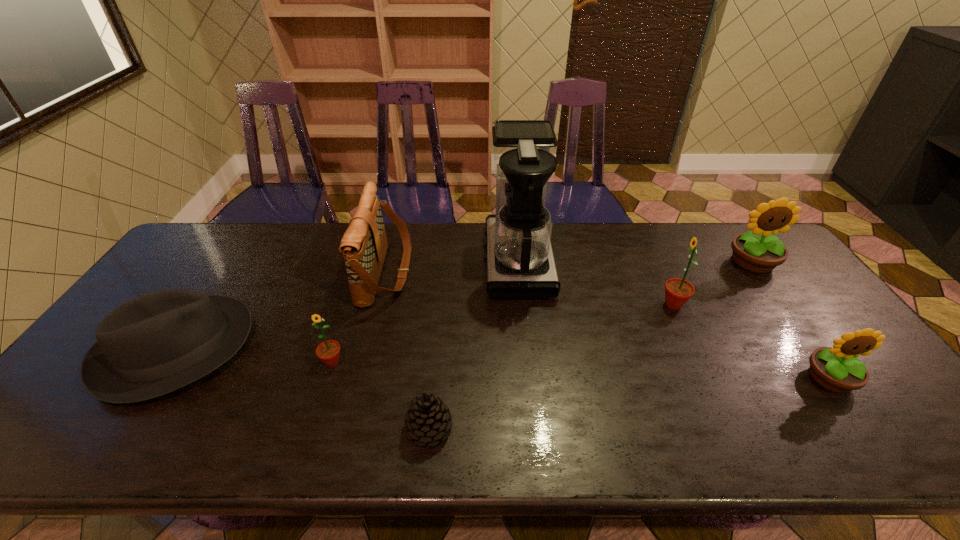
Image resolution: width=960 pixels, height=540 pixels. Identify the location of the fifth object from left to right. (520, 264).

In order to click on coffee maker in this screenshot , I will do `click(520, 264)`.

You are a GUI agent. You are given a task and a screenshot of the screen. Output one action in this format:
    pyautogui.click(x=<x>, y=<y>)
    Task: Click on the farthest sunflower
    
    Given the screenshot: What is the action you would take?
    pyautogui.click(x=759, y=251)

In order to click on the bigger yellow sunflower in this screenshot , I will do `click(759, 251)`.

Where is `the third sunflower from right to left`? the third sunflower from right to left is located at coordinates (677, 291).

Where is `the second farthest sunflower`? The image size is (960, 540). the second farthest sunflower is located at coordinates (677, 291).

Where is `shoulder bag`? Image resolution: width=960 pixels, height=540 pixels. shoulder bag is located at coordinates (364, 245).

This screenshot has height=540, width=960. I want to click on the nearer yellow sunflower, so tap(838, 369).

This screenshot has height=540, width=960. I want to click on the nearer green sunflower, so click(328, 351).

You are a GUI agent. You are given a task and a screenshot of the screen. Output one action in this format:
    pyautogui.click(x=<x>, y=<y>)
    Task: Click on the leftmost sunflower
    The height and width of the screenshot is (540, 960).
    Given the screenshot: What is the action you would take?
    pyautogui.click(x=328, y=351)